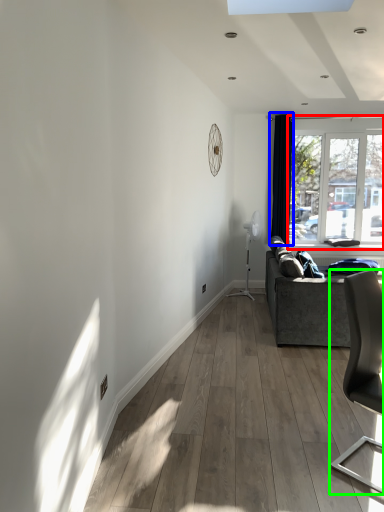
Question: Based on their relative distances, which object is nearer to window (highlighted by a red box)? Choose from curtain (highlighted by a blue box) and chair (highlighted by a green box).

Choices:
 (A) curtain
 (B) chair

Answer: (A)